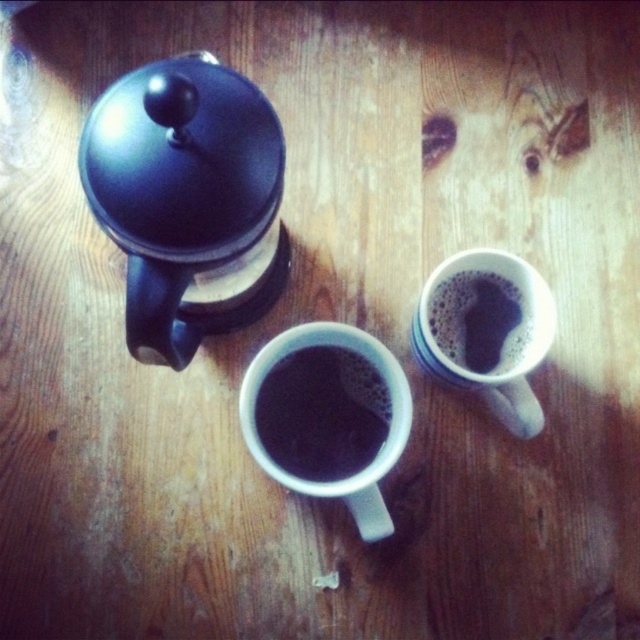
Is white glossy mug at center further to camera compared to satin black coffee at upper right?

No.

Based on the photo, between white glossy mug at center and satin black coffee at upper right, which one has more height?

white glossy mug at center

Does point (243, 416) lie behind point (476, 305)?

No, it is not.

The width and height of the screenshot is (640, 640). What are the coordinates of `white glossy mug at center` in the screenshot? It's located at (378, 451).

Does matte black coffeepot at upper left have a greater height compared to white glossy mug at center?

Indeed, matte black coffeepot at upper left has a greater height compared to white glossy mug at center.

Does matte black coffeepot at upper left have a smaller size compared to white glossy mug at center?

Incorrect, matte black coffeepot at upper left is not smaller in size than white glossy mug at center.

Where is `matte black coffeepot at upper left`? The width and height of the screenshot is (640, 640). matte black coffeepot at upper left is located at coordinates (188, 200).

The image size is (640, 640). I want to click on matte black coffeepot at upper left, so click(x=188, y=200).

Does matte black coffeepot at upper left appear on the left side of satin black coffee at upper right?

Correct, you'll find matte black coffeepot at upper left to the left of satin black coffee at upper right.

Measure the distance between point (250, 237) and camera.

Point (250, 237) and camera are 31.98 inches apart from each other.

Where is `matte black coffeepot at upper left`? This screenshot has width=640, height=640. matte black coffeepot at upper left is located at coordinates (188, 200).